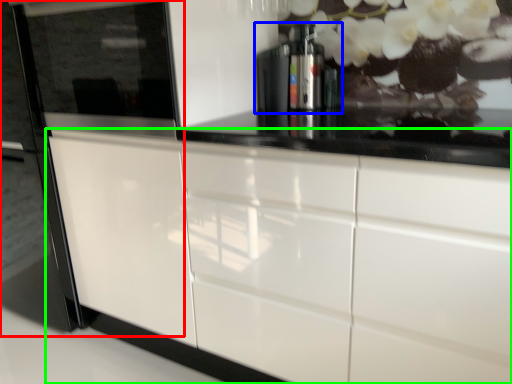
Question: Estimate the real-world distances between objects in this image. Which object is farther from fridge (highlighted by a red box), coffee machine (highlighted by a blue box) or cabinetry (highlighted by a green box)?

Choices:
 (A) coffee machine
 (B) cabinetry

Answer: (A)